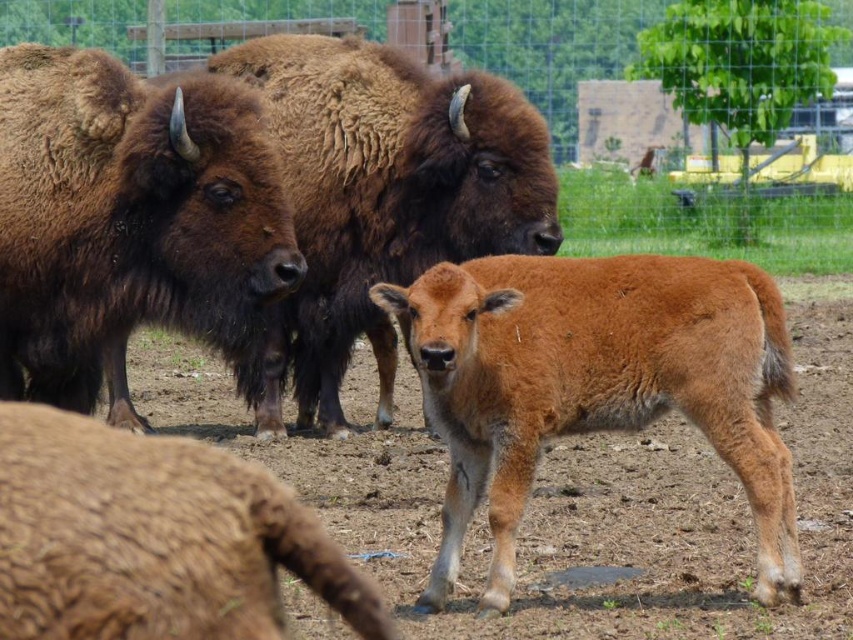
In the scene shown: You are a zookeeper planning to install a feeding trough for the bison. The trough must be accessible to both the brown fuzzy bison at upper left and the brown furry bison at center. Considering their heights, what is the minimum height the trough should be to ensure both can reach it comfortably?

The brown fuzzy bison at upper left has a lesser height compared to brown furry bison at center. To accommodate both, the trough should be set at the height of the taller bison, which is the brown furry bison at center, ensuring the shorter one can still reach it comfortably.

You are a zookeeper observing the bison enclosure. You notice the brown furry calf at center and the brown furry bison at center. Which one is more to the right in the image?

The brown furry calf at center is more to the right because it is positioned on the right side of the brown furry bison at center.